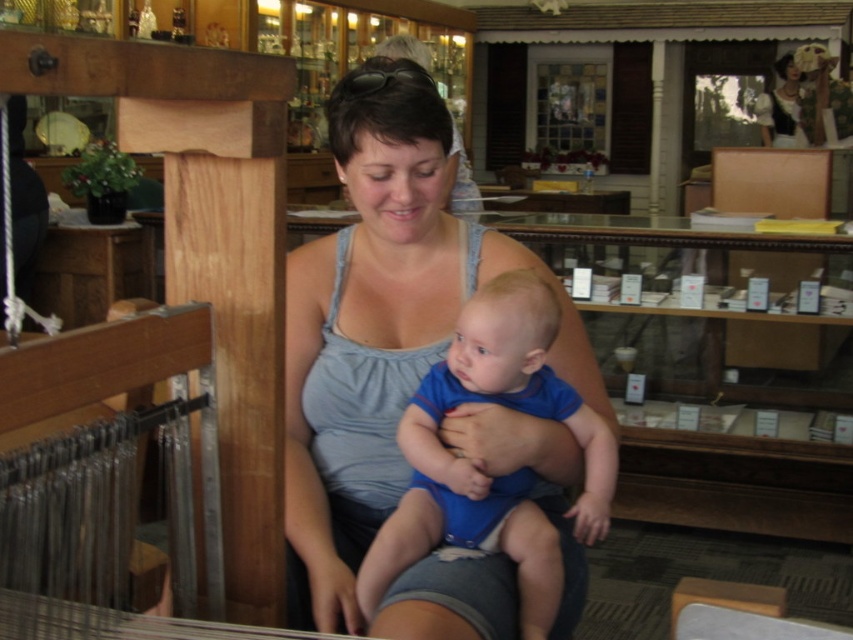
Where is the gray fabric tank top at center located in the image?

The gray fabric tank top at center is located at point coordinates of approximately 0.512 on the x axis and 0.447 on the y axis.

You are a customer in the store and want to buy both the blue cotton onesie at center and the matte black dress at upper right. You need to know which one is on the left side to locate them easily. Which item is positioned to the left?

The blue cotton onesie at center is positioned on the left side of the matte black dress at upper right.

You are a customer in a store and you want to buy both the gray fabric tank top at center and the matte black dress at upper right. Can you reach both items at the same time if you stand in the center of the store?

The gray fabric tank top at center is below matte black dress at upper right, so you can reach both items at the same time by standing in the center of the store.